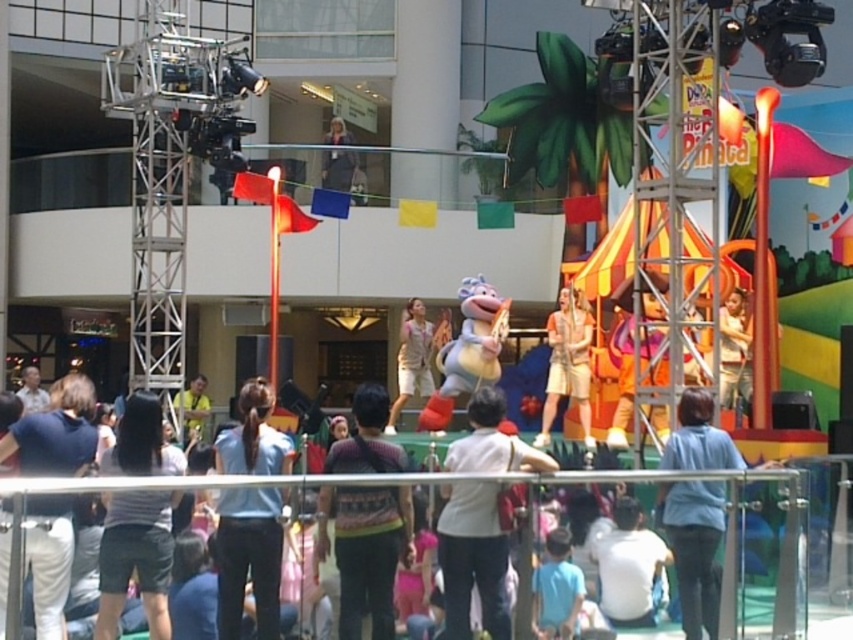
You are organizing a costume party and need to decide which outfit to wear. You have two options from the image provided. The first is the striped fabric shirt at center, and the second is the light beige fabric dress at center. Based on their widths, which outfit would allow you to move more freely in the crowded event area?

The striped fabric shirt at center is thinner than the light beige fabric dress at center, so the striped fabric shirt at center would allow more freedom of movement in a crowded area.

You are a photographer at the event and want to capture both the striped fabric shirt at center and the light beige fabric dress at center in a single frame. Which clothing item should you focus on first to ensure both are in the frame?

The striped fabric shirt at center is shorter than the light beige fabric dress at center, so focusing on the striped fabric shirt at center first will allow you to adjust the camera angle to include both in the frame.

You are a photographer standing at the back of the stage. You want to take a photo that includes both the striped fabric shirt at center and the light beige fabric dress at center. Given that your camera has a maximum focus range of 35 meters, will you be able to capture both subjects in focus?

The striped fabric shirt at center and the light beige fabric dress at center are 38.41 meters apart. Since the distance between them exceeds the camera maximum focus range of 35 meters, you won be able to capture both subjects in focus.